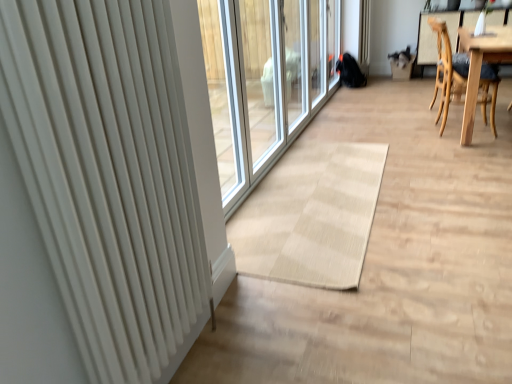
Question: Should I look upward or downward to see light brown wooden chair at right?

Choices:
 (A) up
 (B) down

Answer: (A)

Question: Does white matte radiator at left appear on the left side of light brown wooden chair at right?

Choices:
 (A) yes
 (B) no

Answer: (A)

Question: Is white matte radiator at left closer to camera compared to light brown wooden chair at right?

Choices:
 (A) no
 (B) yes

Answer: (B)

Question: Can you confirm if white matte radiator at left is taller than light brown wooden chair at right?

Choices:
 (A) yes
 (B) no

Answer: (A)

Question: Considering the relative sizes of white matte radiator at left and light brown wooden chair at right in the image provided, is white matte radiator at left smaller than light brown wooden chair at right?

Choices:
 (A) no
 (B) yes

Answer: (B)

Question: Is white matte radiator at left positioned beyond the bounds of light brown wooden chair at right?

Choices:
 (A) no
 (B) yes

Answer: (B)

Question: From a real-world perspective, is white matte radiator at left positioned over light brown wooden chair at right based on gravity?

Choices:
 (A) yes
 (B) no

Answer: (A)

Question: Does light brown wooden chair at right come in front of white matte radiator at left?

Choices:
 (A) yes
 (B) no

Answer: (B)

Question: From the image's perspective, is light brown wooden chair at right below white matte radiator at left?

Choices:
 (A) no
 (B) yes

Answer: (A)

Question: Would you say white matte radiator at left is part of light brown wooden chair at right's contents?

Choices:
 (A) yes
 (B) no

Answer: (B)

Question: Could you tell me if light brown wooden chair at right is facing white matte radiator at left?

Choices:
 (A) yes
 (B) no

Answer: (B)

Question: From a real-world perspective, is light brown wooden chair at right positioned under white matte radiator at left based on gravity?

Choices:
 (A) no
 (B) yes

Answer: (B)

Question: Is light brown wooden chair at right located outside white matte radiator at left?

Choices:
 (A) yes
 (B) no

Answer: (A)

Question: Considering the positions of white matte radiator at left and light brown wooden chair at right in the image, is white matte radiator at left bigger or smaller than light brown wooden chair at right?

Choices:
 (A) small
 (B) big

Answer: (A)